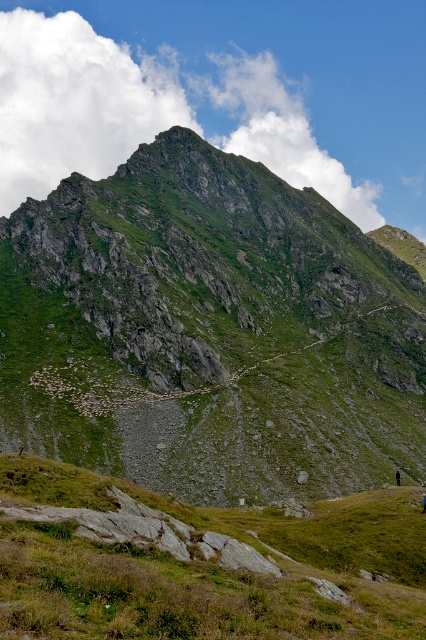
Can you confirm if green rocky mountain at center is smaller than green grassy at lower center?

No.

Can you confirm if green rocky mountain at center is positioned below green grassy at lower center?

No.

Which is in front, point (80, 298) or point (173, 589)?

Point (173, 589)

Locate an element on the screen. green rocky mountain at center is located at coordinates pos(209,332).